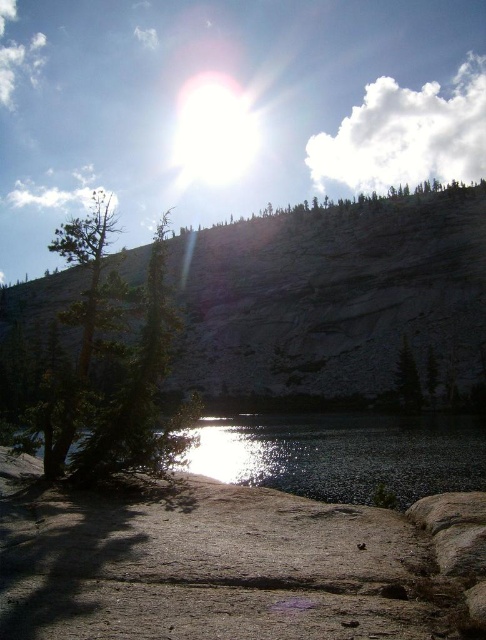
Question: Is smooth gray water at lower left further to the viewer compared to green matte tree at left?

Choices:
 (A) no
 (B) yes

Answer: (A)

Question: Among these objects, which one is nearest to the camera?

Choices:
 (A) smooth gray water at lower left
 (B) green matte tree at center
 (C) green matte tree at lower left
 (D) green matte tree at left

Answer: (A)

Question: Can you confirm if green matte tree at lower left is positioned above green matte tree at center?

Choices:
 (A) yes
 (B) no

Answer: (A)

Question: Which is nearer to the green matte tree at center?

Choices:
 (A) smooth gray water at lower left
 (B) green matte tree at lower left

Answer: (A)

Question: Does green matte tree at lower left lie in front of green matte tree at center?

Choices:
 (A) no
 (B) yes

Answer: (B)

Question: Which is farther from the green matte tree at center?

Choices:
 (A) smooth gray water at lower left
 (B) green matte tree at lower left

Answer: (B)